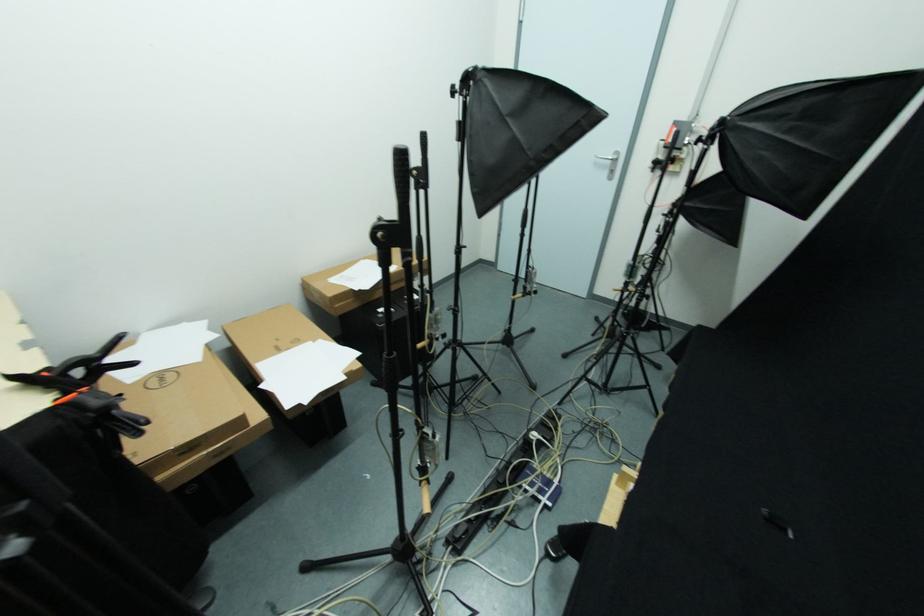
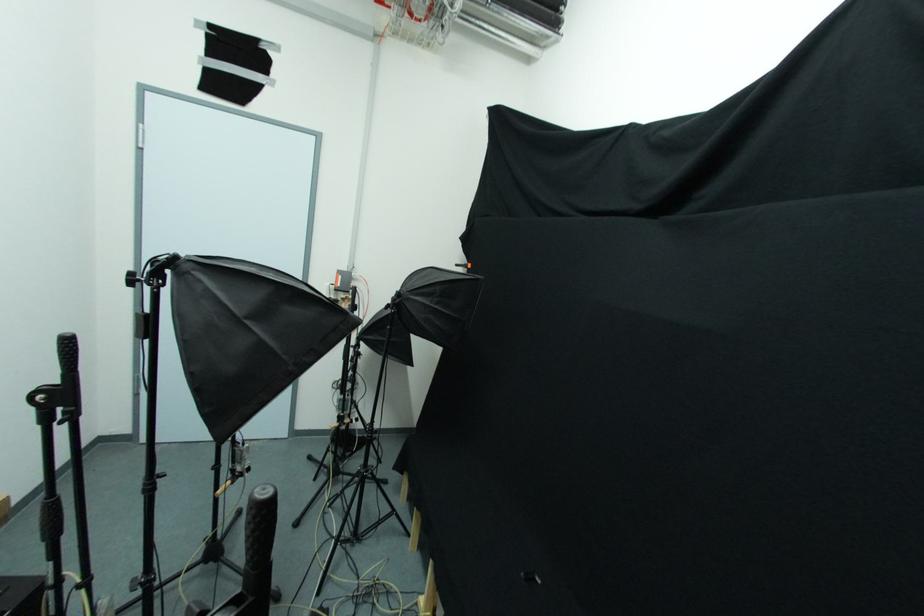
Question: How did the camera likely rotate?

Choices:
 (A) Left
 (B) Right
 (C) Up
 (D) Down

Answer: (B)